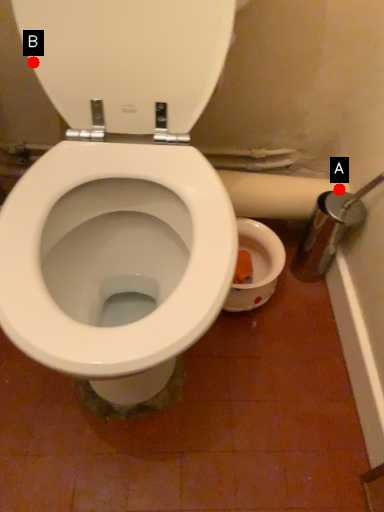
Question: Two points are circled on the image, labeled by A and B beside each circle. Which point is closer to the camera?

Choices:
 (A) A is closer
 (B) B is closer

Answer: (B)